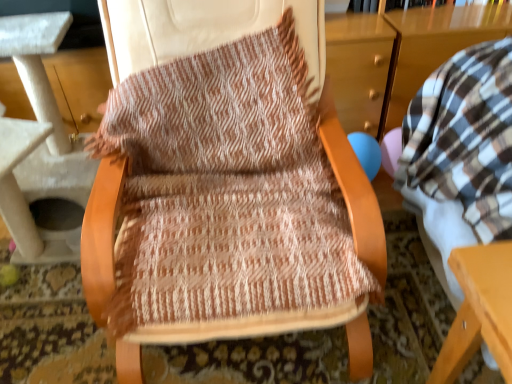
Question: Is white textured cat tree at left smaller than woven fabric chair at center?

Choices:
 (A) no
 (B) yes

Answer: (A)

Question: Is white textured cat tree at left oriented towards woven fabric chair at center?

Choices:
 (A) yes
 (B) no

Answer: (B)

Question: Is white textured cat tree at left wider than woven fabric chair at center?

Choices:
 (A) yes
 (B) no

Answer: (A)

Question: Considering the relative sizes of white textured cat tree at left and woven fabric chair at center in the image provided, is white textured cat tree at left shorter than woven fabric chair at center?

Choices:
 (A) no
 (B) yes

Answer: (A)

Question: Is white textured cat tree at left positioned beyond the bounds of woven fabric chair at center?

Choices:
 (A) no
 (B) yes

Answer: (B)

Question: From the image's perspective, is white textured cat tree at left beneath woven fabric chair at center?

Choices:
 (A) no
 (B) yes

Answer: (A)

Question: Can you confirm if woven fabric chair at center is thinner than white textured cat tree at left?

Choices:
 (A) no
 (B) yes

Answer: (B)

Question: Considering the relative positions of woven fabric chair at center and white textured cat tree at left in the image provided, is woven fabric chair at center to the right of white textured cat tree at left from the viewer's perspective?

Choices:
 (A) yes
 (B) no

Answer: (A)

Question: From a real-world perspective, is woven fabric chair at center on top of white textured cat tree at left?

Choices:
 (A) yes
 (B) no

Answer: (A)

Question: Is woven fabric chair at center to the left of white textured cat tree at left from the viewer's perspective?

Choices:
 (A) no
 (B) yes

Answer: (A)

Question: Does woven fabric chair at center have a greater width compared to white textured cat tree at left?

Choices:
 (A) yes
 (B) no

Answer: (B)

Question: Is woven fabric chair at center aimed at white textured cat tree at left?

Choices:
 (A) yes
 (B) no

Answer: (B)

Question: Is white textured cat tree at left wider or thinner than woven fabric chair at center?

Choices:
 (A) wide
 (B) thin

Answer: (A)